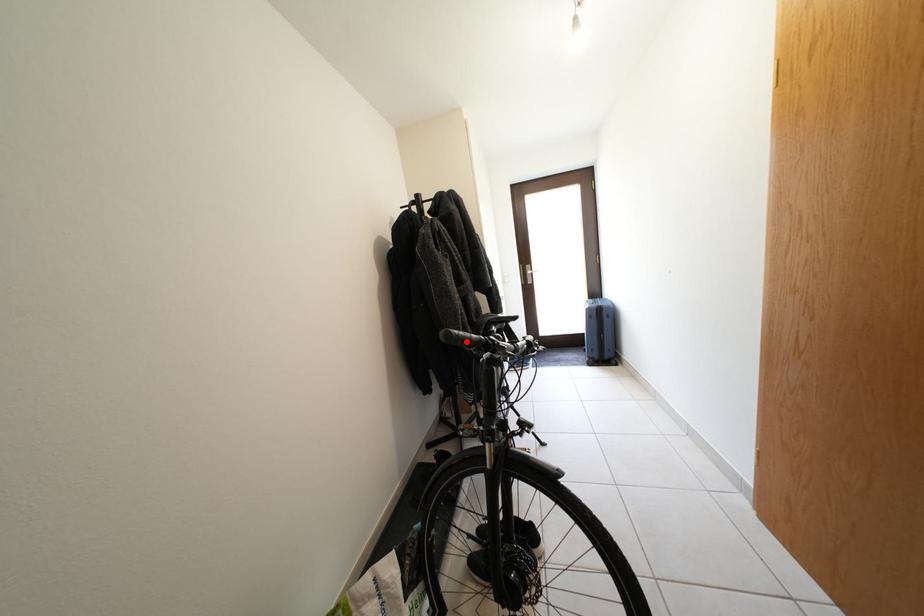
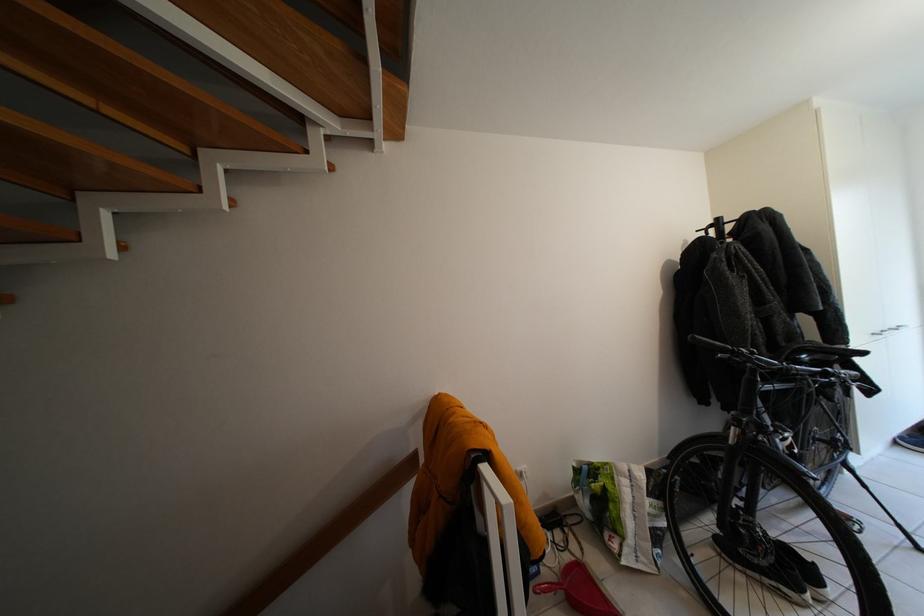
Find the pixel in the second image that matches the highlighted location in the first image.

(710, 345)